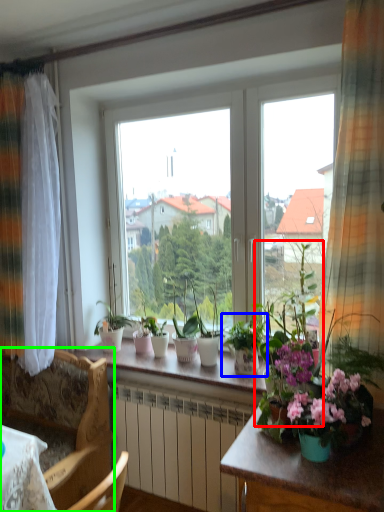
Question: Which object is the farthest from houseplant (highlighted by a red box)? Choose among these: houseplant (highlighted by a blue box) or chair (highlighted by a green box).

Choices:
 (A) houseplant
 (B) chair

Answer: (B)